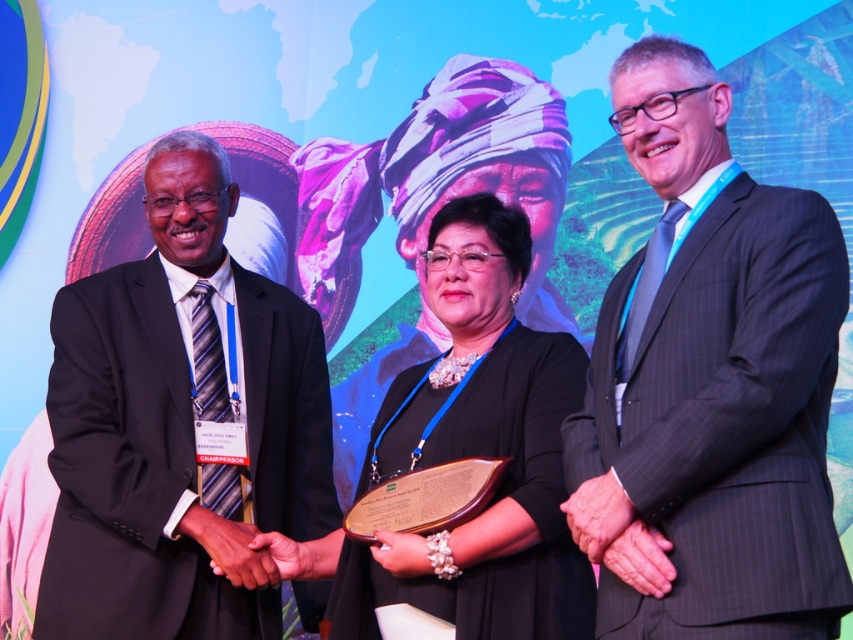
You are a photographer at this event and need to adjust the camera focus to ensure both the gray pinstripe suit at center and the black satin dress at center are in frame. Given their positions, which one is taller and requires adjusting the camera angle upwards?

The gray pinstripe suit at center is taller than the black satin dress at center, so you should adjust the camera angle upwards to capture both in frame.

You are organizing a charity event and need to arrange seating based on the guests attire. The black pinstripe suit at left and the black satin dress at center are attending. Which guest should be seated first according to the size of their attire?

The black pinstripe suit at left should be seated first because it has a larger size compared to the black satin dress at center.

You are a photographer at the event and need to capture a photo of both the gray pinstripe suit at center and the black satin dress at center. Which one is positioned to the right of the other?

The gray pinstripe suit at center is to the right of the black satin dress at center.